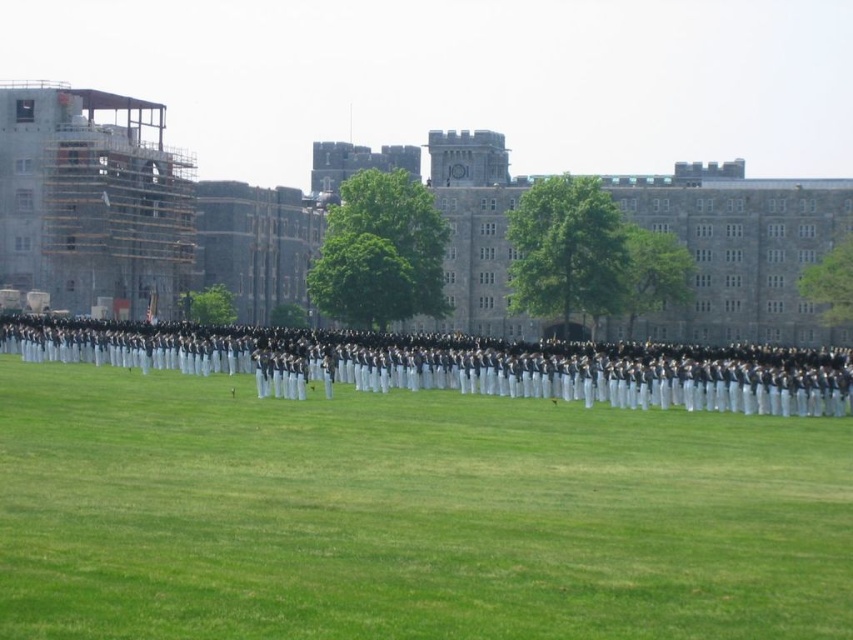
Does gray stone building at upper center have a lesser height compared to scaffolding wood at left?

Incorrect, gray stone building at upper center's height does not fall short of scaffolding wood at left's.

Where is `gray stone building at upper center`? This screenshot has width=853, height=640. gray stone building at upper center is located at coordinates (148, 209).

Between gray stone building at upper center and dark blue uniform at center, which one has more height?

gray stone building at upper center

Find the location of `gray stone building at upper center`. gray stone building at upper center is located at coordinates (148, 209).

Which is above, green grass at center or scaffolding wood at left?

Positioned higher is scaffolding wood at left.

Is point (117, 609) more distant than point (189, 259)?

No.

The height and width of the screenshot is (640, 853). I want to click on green grass at center, so click(x=407, y=515).